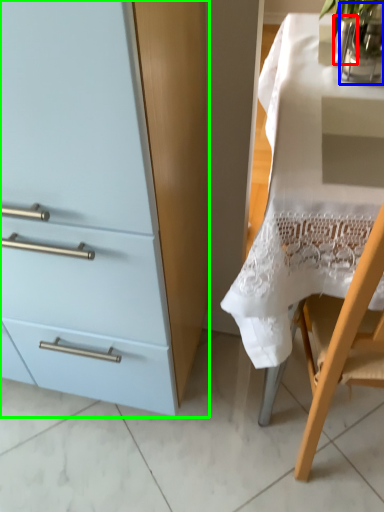
Question: Which object is positioned farthest from glass vase (highlighted by a red box)? Select from glass vase (highlighted by a blue box) and cabinetry (highlighted by a green box).

Choices:
 (A) glass vase
 (B) cabinetry

Answer: (B)